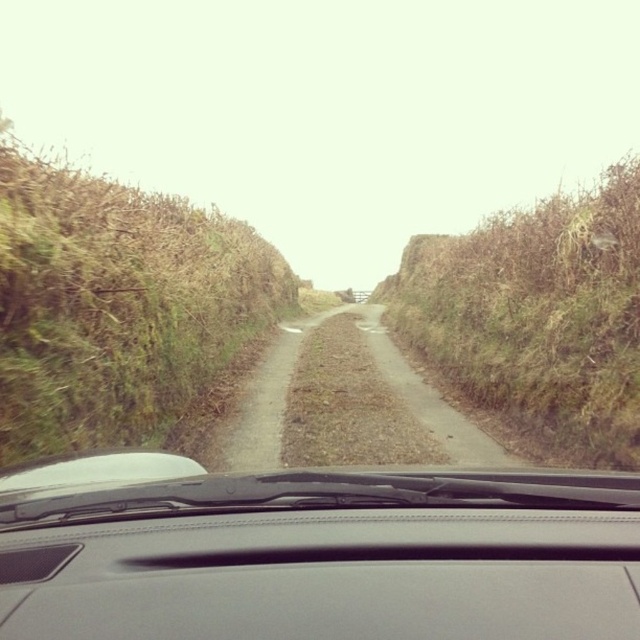
Looking at this image, you are driving a car that is 15 feet long. You want to park your car so that the front bumper is exactly at point (45, 500). Is there enough space behind this point to fit your car?

The distance between point (45, 500) and the viewer is 488.29 feet. Since the car is only 15 feet long, there is more than enough space behind the point to park the car.